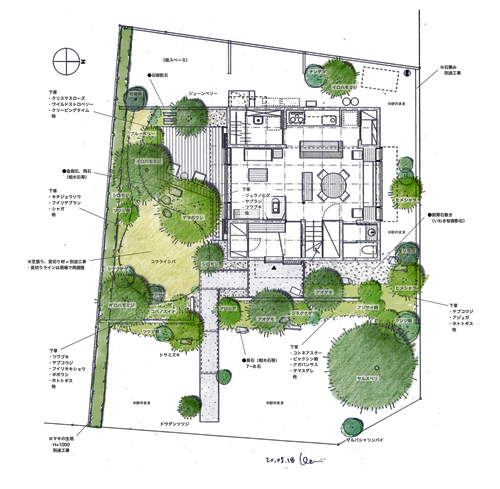
Identify the location of stairs. Image resolution: width=500 pixels, height=489 pixels. (299, 236).